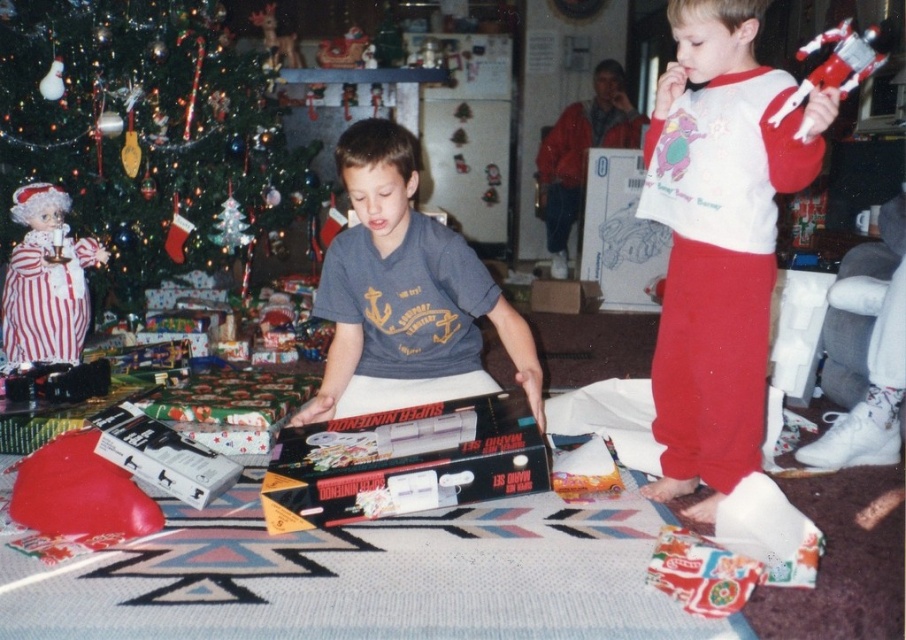
You are a delivery person holding a 1.80 meter long ladder that needs to be placed in the living room. The ladder must be positioned between the black matte Donkey Kong game at center and the camera. Is there enough space to place the ladder horizontally without bending it?

The distance between the black matte Donkey Kong game at center and the camera is 1.70 meters. Since the ladder is 1.80 meters long, it is 0.10 meters longer than the available space. Therefore, the ladder cannot be placed horizontally without bending it.

In the Christmas scene, there is a green matte Christmas tree at upper left and a matte gray shirt at center. Which object is positioned to the left of the other?

The green matte christmas tree at upper left is to the left of the matte gray shirt at center.

You are a parent trying to place a gift for your child on a shelf. The shelf has limited height space. Which item between the white cotton shirt at upper right and the red plastic robot at upper right can you place on the shelf without exceeding the height limit?

The red plastic robot at upper right can be placed on the shelf without exceeding the height limit since it is shorter than the white cotton shirt at upper right.